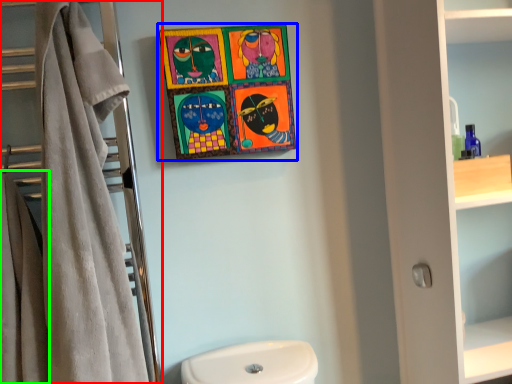
Question: Which object is positioned farthest from closet (highlighted by a red box)? Select from picture frame (highlighted by a blue box) and bath towel (highlighted by a green box).

Choices:
 (A) picture frame
 (B) bath towel

Answer: (A)